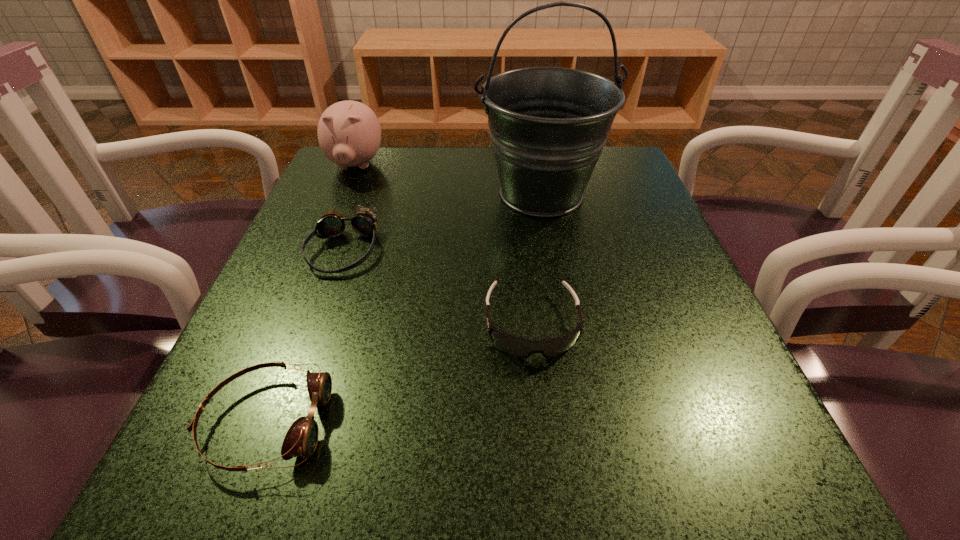
Locate an element on the screen. The height and width of the screenshot is (540, 960). vacant space situated 0.170m through the lenses of the nearest goggles is located at coordinates (457, 422).

The height and width of the screenshot is (540, 960). In order to click on bucket situated at the far edge in this screenshot , I will do `click(548, 125)`.

You are a GUI agent. You are given a task and a screenshot of the screen. Output one action in this format:
    pyautogui.click(x=<x>, y=<y>)
    Task: Click on the piggy bank situated at the far edge
    This screenshot has width=960, height=540.
    Given the screenshot: What is the action you would take?
    pyautogui.click(x=349, y=133)

This screenshot has width=960, height=540. I want to click on object located at the near edge, so 301,439.

I want to click on piggy bank that is at the left edge, so click(x=349, y=133).

At what (x,y) coordinates should I click in order to perform the action: click on object that is at the right edge. Please return your answer as a coordinate pair (x, y). The image size is (960, 540). Looking at the image, I should click on (548, 125).

The image size is (960, 540). In order to click on object positioned at the far left corner in this screenshot , I will do `click(349, 133)`.

The height and width of the screenshot is (540, 960). Identify the location of object located in the near left corner section of the desktop. (301, 439).

This screenshot has height=540, width=960. I want to click on object at the far right corner, so click(x=548, y=125).

The image size is (960, 540). I want to click on vacant space at the far edge, so click(409, 155).